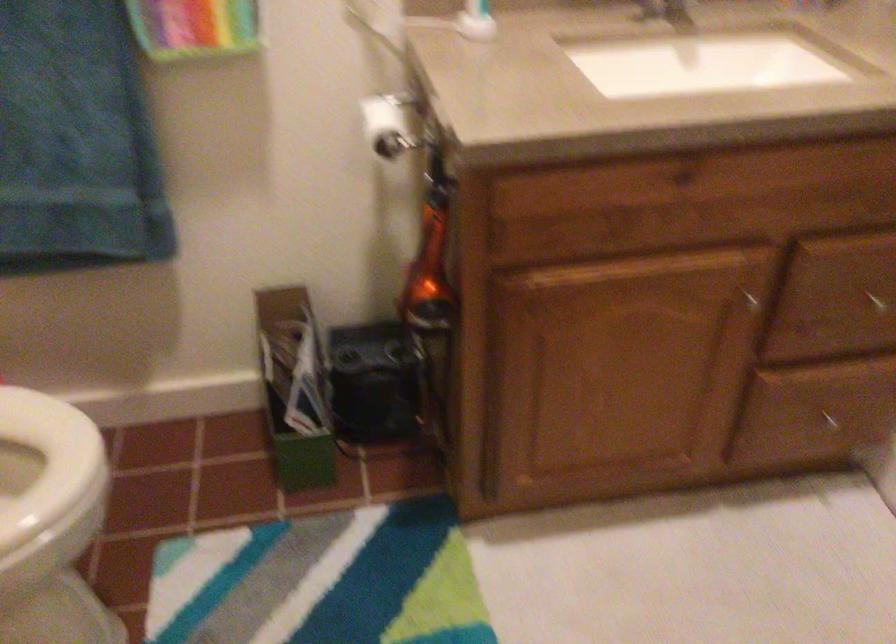
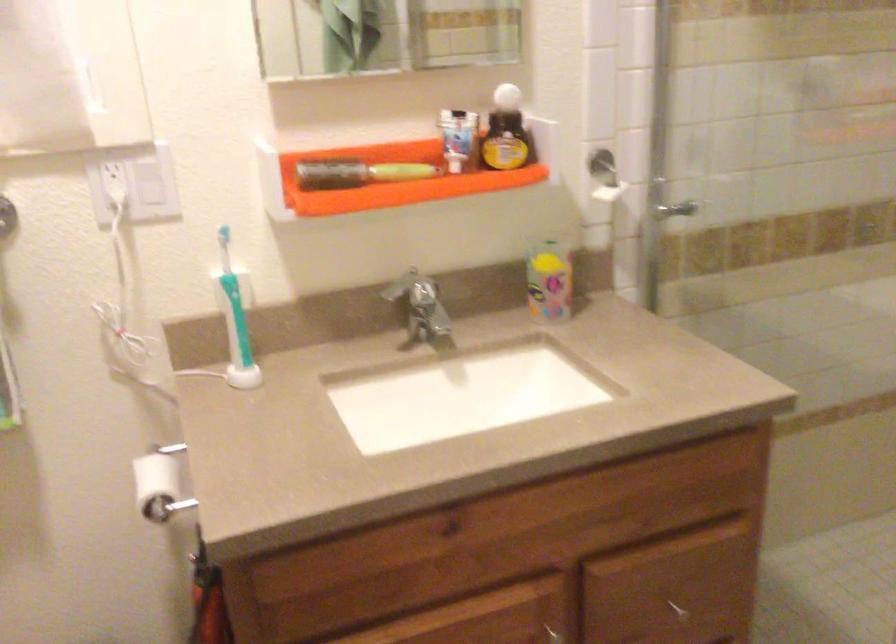
Question: The images are taken continuously from a first-person perspective. In which direction are you moving?

Choices:
 (A) Left
 (B) Right
 (C) Forward
 (D) Backward

Answer: (B)